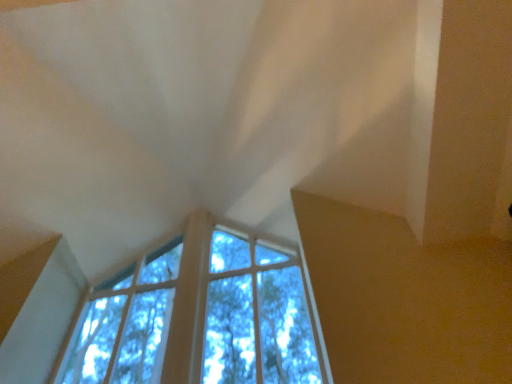
The height and width of the screenshot is (384, 512). Describe the element at coordinates (200, 316) in the screenshot. I see `clear glass window at center` at that location.

Where is `clear glass window at center`? Image resolution: width=512 pixels, height=384 pixels. clear glass window at center is located at coordinates (200, 316).

Locate an element on the screen. clear glass window at center is located at coordinates (200, 316).